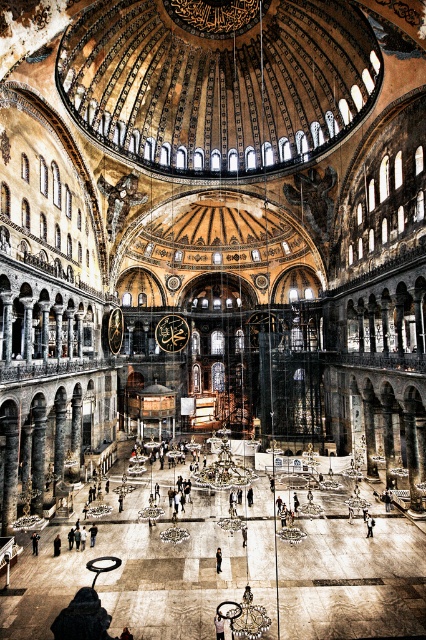
Is black leather jacket at center closer to the viewer compared to dark blue jeans at center?

Yes, black leather jacket at center is closer to the viewer.

Measure the distance between black leather jacket at center and camera.

black leather jacket at center and camera are 222.47 feet apart.

The width and height of the screenshot is (426, 640). I want to click on black leather jacket at center, so click(x=34, y=541).

The height and width of the screenshot is (640, 426). I want to click on black leather jacket at center, so click(x=34, y=541).

From the picture: Between black leather jacket at center and dark gray fabric jacket at center, which one has more height?

black leather jacket at center

Consider the image. Is black leather jacket at center shorter than dark gray fabric jacket at center?

No, black leather jacket at center is not shorter than dark gray fabric jacket at center.

Is point (36, 532) closer to camera compared to point (218, 568)?

No, (36, 532) is further to viewer.

Where is `black leather jacket at center`? Image resolution: width=426 pixels, height=640 pixels. black leather jacket at center is located at coordinates 34,541.

Measure the distance between dark blue jeans at center and dark gray fabric jacket at center.

The distance of dark blue jeans at center from dark gray fabric jacket at center is 24.42 meters.

Can you confirm if dark blue jeans at center is shorter than dark gray fabric jacket at center?

Indeed, dark blue jeans at center has a lesser height compared to dark gray fabric jacket at center.

Who is more forward, (370, 529) or (218, 556)?

Positioned in front is point (218, 556).

Locate an element on the screen. dark blue jeans at center is located at coordinates (370, 524).